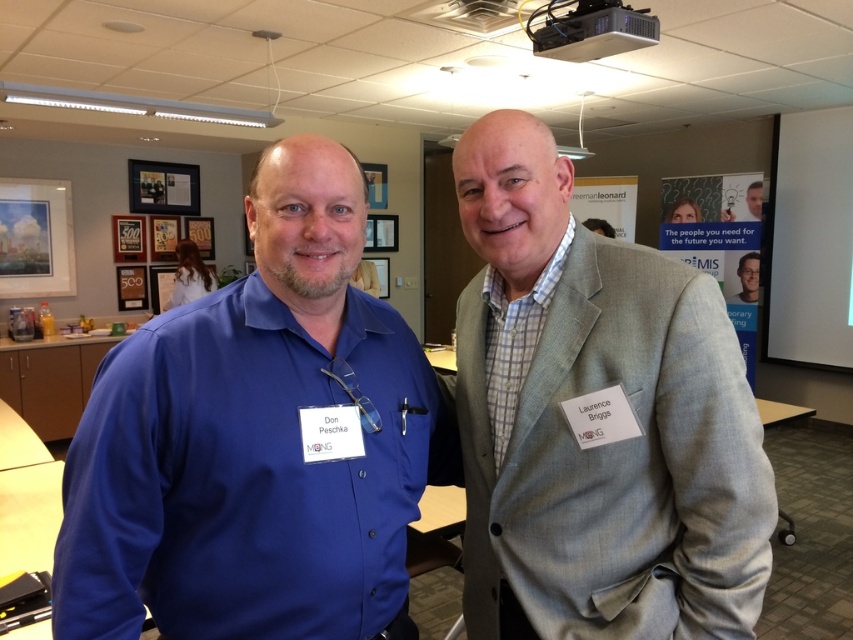
Question: Which object is the farthest from the gray wool suit at center?

Choices:
 (A) white matte projector screen at upper right
 (B) matte blue shirt at left
 (C) white fabric at upper left

Answer: (A)

Question: Can you confirm if gray wool suit at center is positioned above white fabric at upper left?

Choices:
 (A) no
 (B) yes

Answer: (A)

Question: Which object is the farthest from the white matte projector screen at upper right?

Choices:
 (A) gray wool suit at center
 (B) white fabric at upper left
 (C) matte blue shirt at left

Answer: (C)

Question: Does gray wool suit at center have a lesser width compared to white fabric at upper left?

Choices:
 (A) no
 (B) yes

Answer: (B)

Question: Does matte blue shirt at left have a greater width compared to gray wool suit at center?

Choices:
 (A) no
 (B) yes

Answer: (B)

Question: Estimate the real-world distances between objects in this image. Which object is closer to the gray wool suit at center?

Choices:
 (A) white matte projector screen at upper right
 (B) white fabric at upper left
 (C) matte blue shirt at left

Answer: (C)